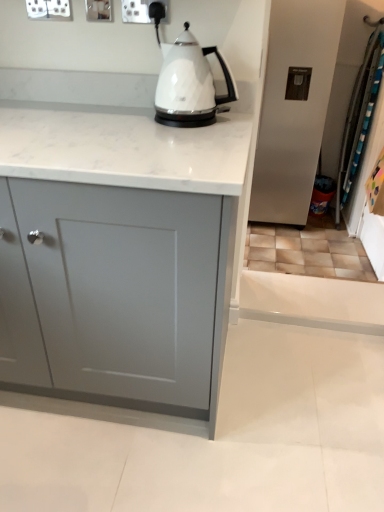
In order to face white plastic socket at upper center, should I rotate leftwards or rightwards?

Turn left by 6.043 degrees to look at white plastic socket at upper center.

Locate an element on the screen. The height and width of the screenshot is (512, 384). white plastic socket at upper center is located at coordinates (141, 11).

Image resolution: width=384 pixels, height=512 pixels. Identify the location of matte gray cabinet at center. (128, 249).

Considering the relative positions of matte gray cabinet at center and white glossy kettle at center in the image provided, is matte gray cabinet at center to the left of white glossy kettle at center from the viewer's perspective?

Indeed, matte gray cabinet at center is positioned on the left side of white glossy kettle at center.

The image size is (384, 512). Find the location of `kettle above the matte gray cabinet at center (from the image's perspective)`. kettle above the matte gray cabinet at center (from the image's perspective) is located at coordinates (189, 83).

Is matte gray cabinet at center inside the boundaries of white glossy kettle at center, or outside?

matte gray cabinet at center is not inside white glossy kettle at center, it's outside.

Can you confirm if matte gray cabinet at center is smaller than white glossy kettle at center?

No, matte gray cabinet at center is not smaller than white glossy kettle at center.

How different are the orientations of white plastic socket at upper center and matte gray cabinet at center in degrees?

They differ by 0.00224 degrees in their facing directions.

From a real-world perspective, is white plastic socket at upper center on matte gray cabinet at center?

Correct, in the physical world, white plastic socket at upper center is higher than matte gray cabinet at center.

Is white plastic socket at upper center in contact with matte gray cabinet at center?

No.

I want to click on cabinetry that is on the left side of white plastic socket at upper center, so click(128, 249).

Looking at this image, which object is further away from the camera taking this photo, white glossy kettle at center or white plastic socket at upper center?

white plastic socket at upper center is further away from the camera.

Consider the image. From a real-world perspective, does white glossy kettle at center stand above white plastic socket at upper center?

Actually, white glossy kettle at center is physically below white plastic socket at upper center in the real world.

Are white glossy kettle at center and white plastic socket at upper center making contact?

No, white glossy kettle at center is not making contact with white plastic socket at upper center.

Is white plastic socket at upper center touching white glossy kettle at center?

No, white plastic socket at upper center is not making contact with white glossy kettle at center.

What's the angular difference between white plastic socket at upper center and white glossy kettle at center's facing directions?

0.00242 degrees separate the facing orientations of white plastic socket at upper center and white glossy kettle at center.

Considering the positions of objects white plastic socket at upper center and white glossy kettle at center in the image provided, who is behind, white plastic socket at upper center or white glossy kettle at center?

white plastic socket at upper center is behind.

Between white plastic socket at upper center and white glossy kettle at center, which one has more height?

white glossy kettle at center is taller.

Is matte gray cabinet at center further to camera compared to white plastic socket at upper center?

No, it is not.

Is matte gray cabinet at center far from white plastic socket at upper center?

Actually, matte gray cabinet at center and white plastic socket at upper center are a little close together.

Is matte gray cabinet at center facing towards white plastic socket at upper center?

No.

In terms of size, does matte gray cabinet at center appear bigger or smaller than white plastic socket at upper center?

matte gray cabinet at center is bigger than white plastic socket at upper center.

Considering the sizes of objects white glossy kettle at center and matte gray cabinet at center in the image provided, who is thinner, white glossy kettle at center or matte gray cabinet at center?

white glossy kettle at center.

Could you tell me if white glossy kettle at center is facing matte gray cabinet at center?

No, white glossy kettle at center is not oriented towards matte gray cabinet at center.

From a real-world perspective, is white glossy kettle at center located beneath matte gray cabinet at center?

Actually, white glossy kettle at center is physically above matte gray cabinet at center in the real world.

This screenshot has width=384, height=512. I want to click on cabinetry located below the white glossy kettle at center (from the image's perspective), so click(128, 249).

What are the coordinates of `electric outlet that appears behind the matte gray cabinet at center` in the screenshot? It's located at (141, 11).

Looking at this image, based on their spatial positions, is white plastic socket at upper center or matte gray cabinet at center closer to white glossy kettle at center?

Based on the image, white plastic socket at upper center appears to be nearer to white glossy kettle at center.

Considering their positions, is white glossy kettle at center positioned further to white plastic socket at upper center than matte gray cabinet at center?

Based on the image, matte gray cabinet at center appears to be further to white plastic socket at upper center.

Estimate the real-world distances between objects in this image. Which object is closer to matte gray cabinet at center, white glossy kettle at center or white plastic socket at upper center?

Among the two, white glossy kettle at center is located nearer to matte gray cabinet at center.

Looking at the image, which one is located closer to matte gray cabinet at center, white plastic socket at upper center or white glossy kettle at center?

white glossy kettle at center lies closer to matte gray cabinet at center than the other object.

Estimate the real-world distances between objects in this image. Which object is further from white glossy kettle at center, matte gray cabinet at center or white plastic socket at upper center?

matte gray cabinet at center.

Considering their positions, is matte gray cabinet at center positioned further to white plastic socket at upper center than white glossy kettle at center?

matte gray cabinet at center.

Identify the location of kettle that lies between white plastic socket at upper center and matte gray cabinet at center from top to bottom. The height and width of the screenshot is (512, 384). pos(189,83).